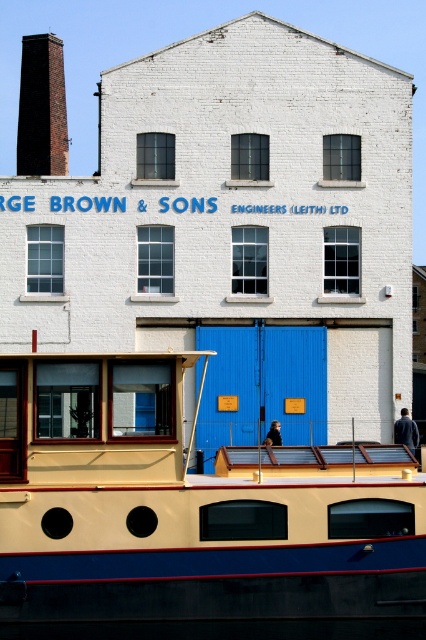
Question: Observing the image, what is the correct spatial positioning of beige wood boat at center in reference to dark red brick chimney at upper left?

Choices:
 (A) right
 (B) left

Answer: (A)

Question: Which point appears farthest from the camera in this image?

Choices:
 (A) (213, 620)
 (B) (36, 99)

Answer: (B)

Question: Is beige wood boat at center to the right of dark red brick chimney at upper left from the viewer's perspective?

Choices:
 (A) yes
 (B) no

Answer: (A)

Question: Which point is farther to the camera?

Choices:
 (A) (60, 413)
 (B) (46, 86)

Answer: (B)

Question: Can you confirm if beige wood boat at center is bigger than dark red brick chimney at upper left?

Choices:
 (A) no
 (B) yes

Answer: (A)